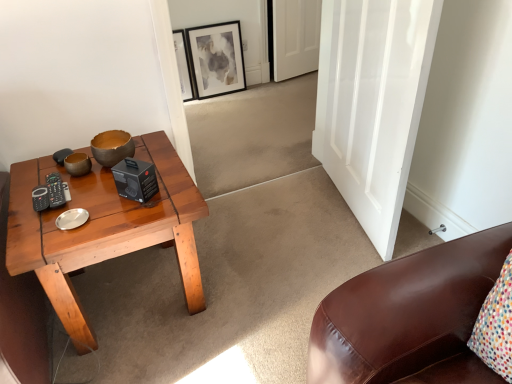
This screenshot has height=384, width=512. Find the location of `vacant space in front of white glossy door at center, which is the 2th door from top to bottom`. vacant space in front of white glossy door at center, which is the 2th door from top to bottom is located at coordinates (307, 275).